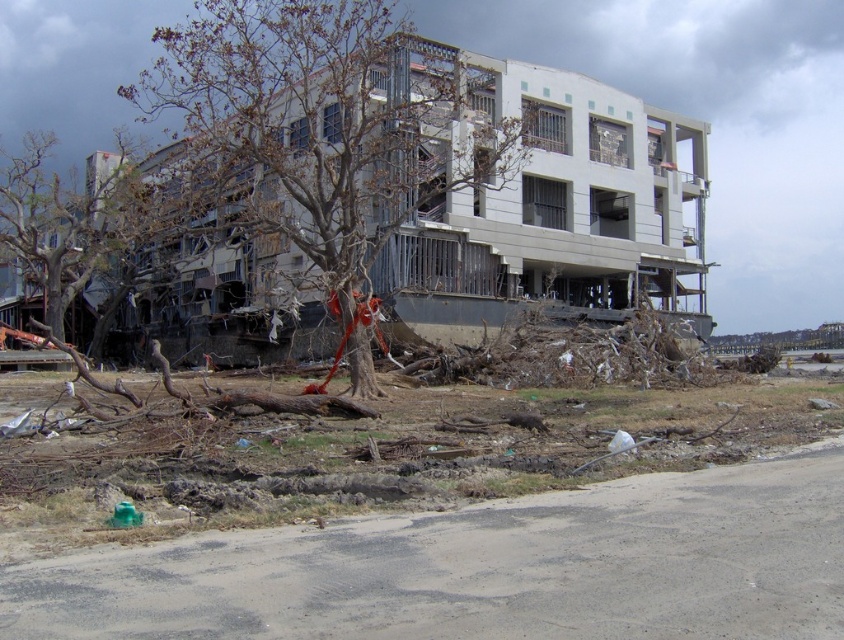
Question: Can you confirm if brown leafless tree at center is positioned to the right of bare wood tree at left?

Choices:
 (A) yes
 (B) no

Answer: (A)

Question: Is brown leafless tree at center to the left of bare wood tree at left from the viewer's perspective?

Choices:
 (A) no
 (B) yes

Answer: (A)

Question: Can you confirm if brown leafless tree at center is positioned to the left of bare wood tree at left?

Choices:
 (A) yes
 (B) no

Answer: (B)